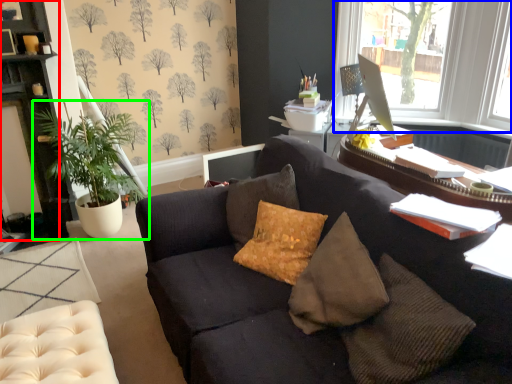
Question: Which object is the farthest from cabinetry (highlighted by a red box)? Choose among these: window (highlighted by a blue box) or houseplant (highlighted by a green box).

Choices:
 (A) window
 (B) houseplant

Answer: (A)